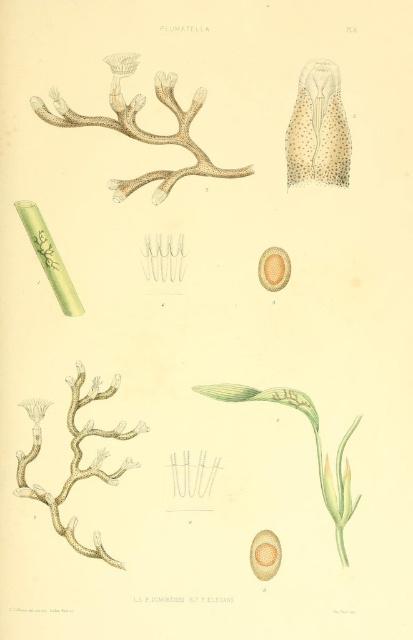
Is translucent white coral at upper left smaller than spotted beige coral at upper right?

No, translucent white coral at upper left is not smaller than spotted beige coral at upper right.

Is point (116, 92) less distant than point (322, 60)?

Yes, point (116, 92) is closer to viewer.

From the picture: Who is more forward, [133,60] or [292,145]?

Point [133,60] is in front.

Locate an element on the screen. This screenshot has width=413, height=640. translucent white coral at upper left is located at coordinates (140, 129).

Between point (18, 474) and point (237, 392), which one is positioned in front?

Point (18, 474)

This screenshot has height=640, width=413. Find the location of `translucent white coral at center`. translucent white coral at center is located at coordinates (75, 460).

Find the location of a particular element. This screenshot has height=640, width=413. translucent white coral at center is located at coordinates (75, 460).

Is translucent white coral at upper left smaller than translucent white coral at center?

Incorrect, translucent white coral at upper left is not smaller in size than translucent white coral at center.

What do you see at coordinates (140, 129) in the screenshot?
I see `translucent white coral at upper left` at bounding box center [140, 129].

Where is `translucent white coral at upper left`? This screenshot has height=640, width=413. translucent white coral at upper left is located at coordinates (140, 129).